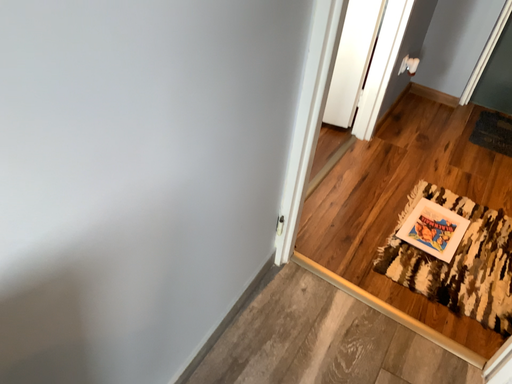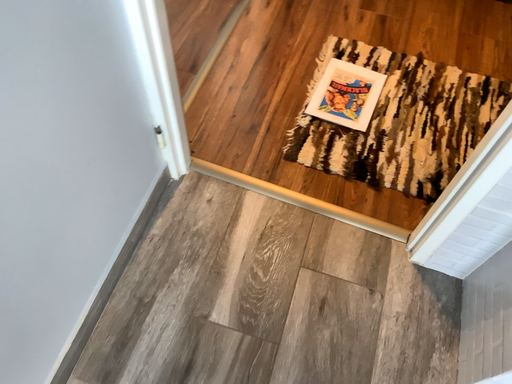
Question: How did the camera likely rotate when shooting the video?

Choices:
 (A) rotated left
 (B) rotated right

Answer: (B)